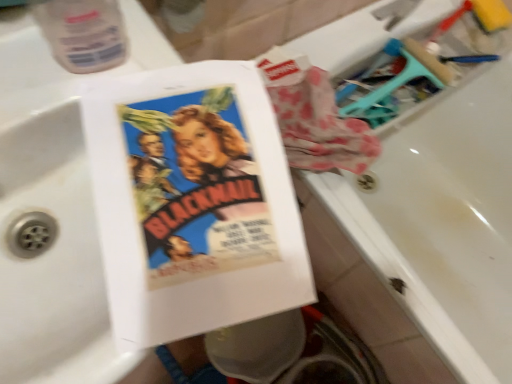
This screenshot has width=512, height=384. Find the location of `vacant space in front of transparent plastic bottle at upper left`. vacant space in front of transparent plastic bottle at upper left is located at coordinates (99, 155).